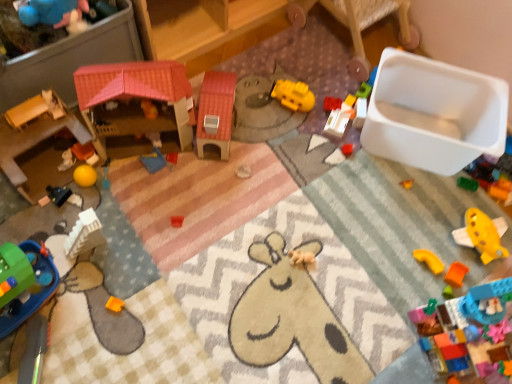
Where is `vacant area that lies between yellow matte plastic arch at lower right, which appears as the twelfth toy when viewed from the left, and yellow plastic airplane at lower right, which appears as the first toy when viewed from the right`? This screenshot has height=384, width=512. vacant area that lies between yellow matte plastic arch at lower right, which appears as the twelfth toy when viewed from the left, and yellow plastic airplane at lower right, which appears as the first toy when viewed from the right is located at coordinates (437, 253).